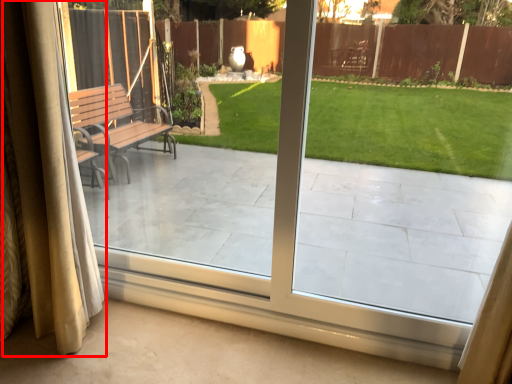
Question: Where is curtain (annotated by the red box) located in relation to porch in the image?

Choices:
 (A) right
 (B) left

Answer: (B)